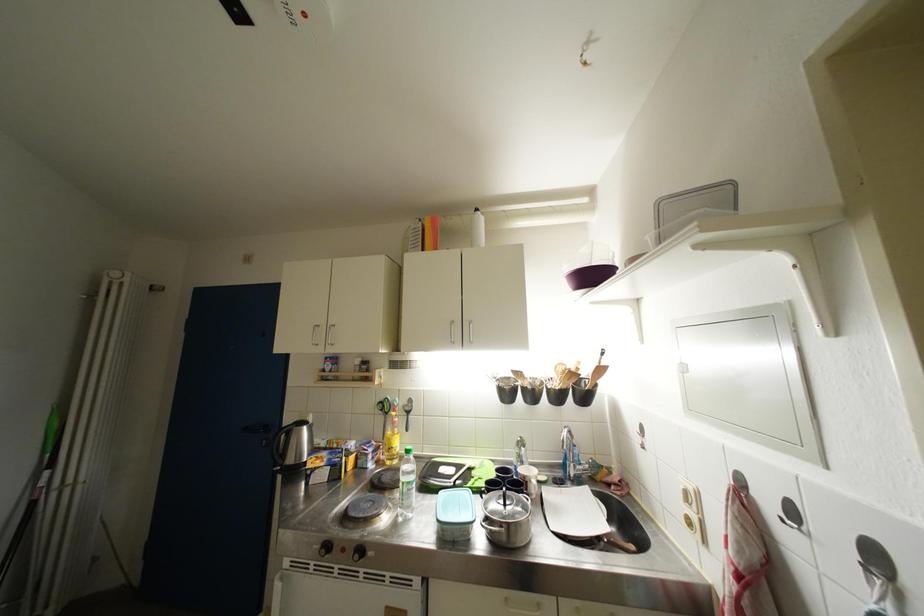
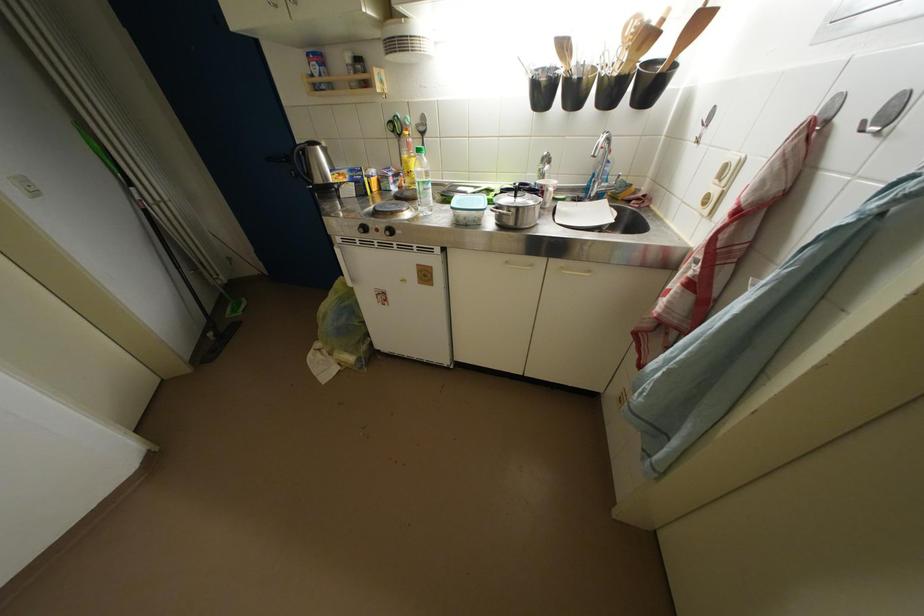
The point at (444, 525) is marked in the first image. Where is the corresponding point in the second image?

(458, 212)